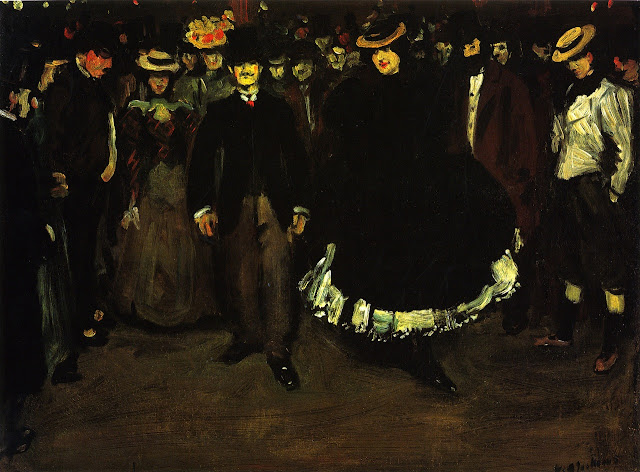
Where is `empty floor on right of painting`? This screenshot has height=472, width=640. empty floor on right of painting is located at coordinates (518, 419).